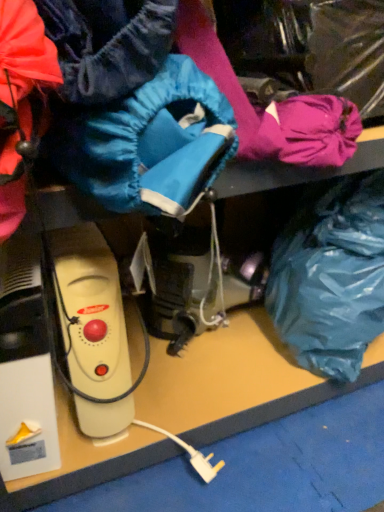
What do you see at coordinates (331, 276) in the screenshot? This screenshot has width=384, height=512. I see `blue plastic bag at lower right` at bounding box center [331, 276].

Locate an element on the screen. blue plastic bag at lower right is located at coordinates (331, 276).

The image size is (384, 512). I want to click on blue plastic bag at lower right, so click(331, 276).